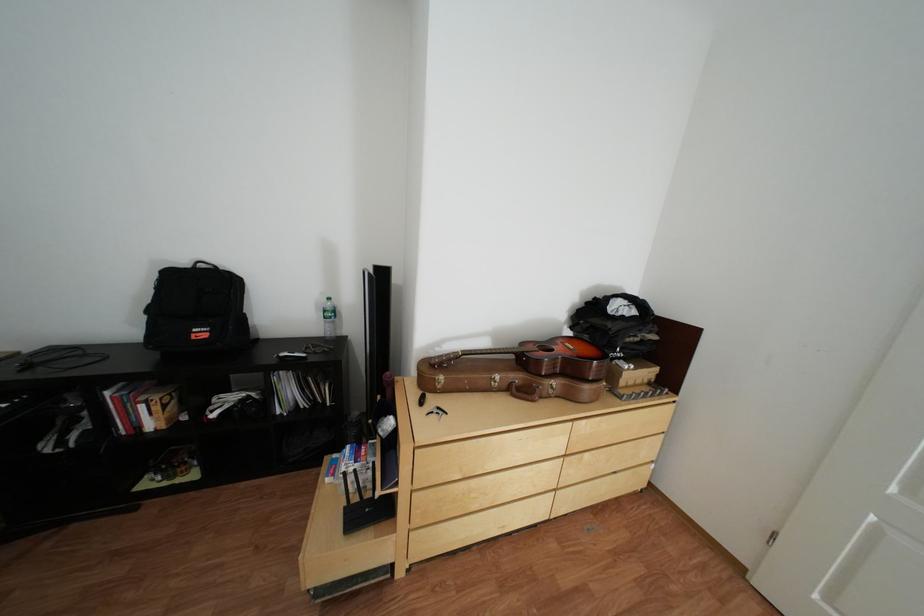
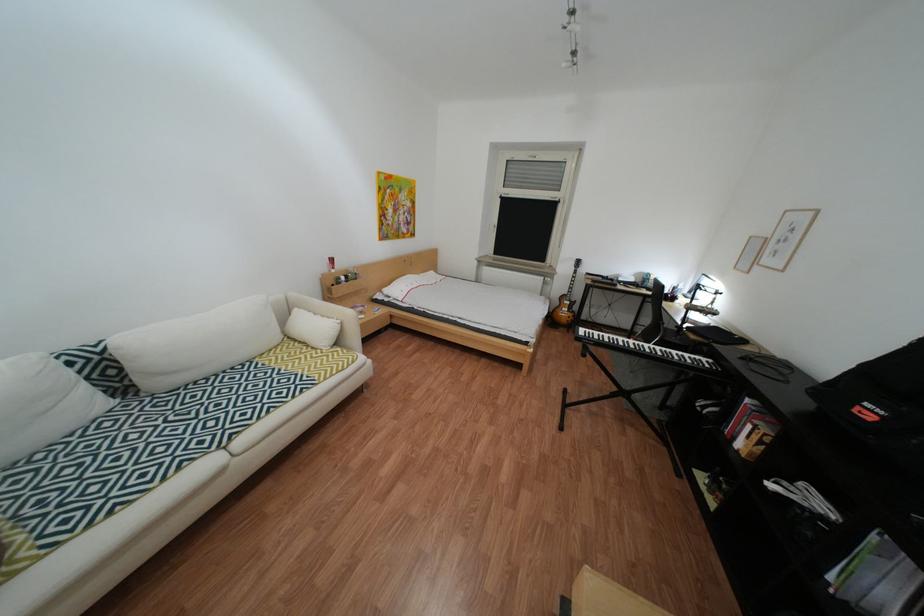
In the second image, find the point that corresponds to point (154, 429) in the first image.

(749, 439)